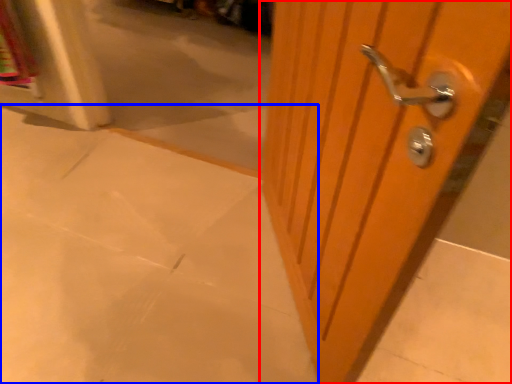
Question: Which object appears closest to the camera in this image, door (highlighted by a red box) or concrete (highlighted by a blue box)?

Choices:
 (A) door
 (B) concrete

Answer: (A)